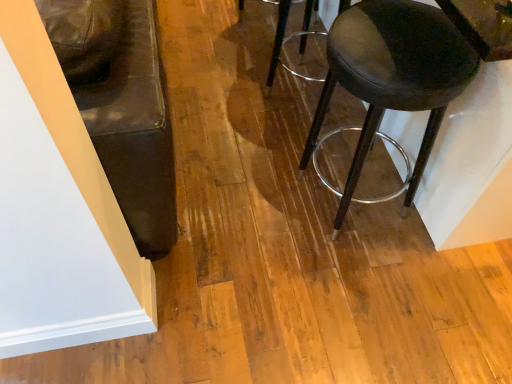
Question: Is matte black stool at right, the 1th stool positioned from the bottom, bigger than transparent plastic stool at center, which ranks as the 2th stool in bottom-to-top order?

Choices:
 (A) no
 (B) yes

Answer: (B)

Question: Does matte black stool at right, which ranks as the 2th stool in top-to-bottom order, have a smaller size compared to transparent plastic stool at center, which ranks as the 2th stool in bottom-to-top order?

Choices:
 (A) no
 (B) yes

Answer: (A)

Question: Considering the relative sizes of matte black stool at right, which ranks as the 2th stool in top-to-bottom order, and transparent plastic stool at center, which ranks as the 2th stool in bottom-to-top order, in the image provided, is matte black stool at right, which ranks as the 2th stool in top-to-bottom order, taller than transparent plastic stool at center, which ranks as the 2th stool in bottom-to-top order,?

Choices:
 (A) yes
 (B) no

Answer: (A)

Question: Does matte black stool at right, which ranks as the 2th stool in top-to-bottom order, lie in front of transparent plastic stool at center, which ranks as the 2th stool in bottom-to-top order?

Choices:
 (A) no
 (B) yes

Answer: (B)

Question: From the image's perspective, is matte black stool at right, the 1th stool positioned from the bottom, over transparent plastic stool at center, which ranks as the 2th stool in bottom-to-top order?

Choices:
 (A) yes
 (B) no

Answer: (B)

Question: Is matte black stool at right, which ranks as the 2th stool in top-to-bottom order, completely or partially outside of transparent plastic stool at center, which ranks as the 2th stool in bottom-to-top order?

Choices:
 (A) no
 (B) yes

Answer: (B)

Question: From the image's perspective, is transparent plastic stool at center, which ranks as the 2th stool in bottom-to-top order, located beneath matte black stool at right, the 1th stool positioned from the bottom?

Choices:
 (A) no
 (B) yes

Answer: (A)

Question: Considering the relative sizes of transparent plastic stool at center, which is the 1th stool in top-to-bottom order, and matte black stool at right, the 1th stool positioned from the bottom, in the image provided, is transparent plastic stool at center, which is the 1th stool in top-to-bottom order, shorter than matte black stool at right, the 1th stool positioned from the bottom,?

Choices:
 (A) yes
 (B) no

Answer: (A)

Question: Does transparent plastic stool at center, which is the 1th stool in top-to-bottom order, appear on the left side of matte black stool at right, which ranks as the 2th stool in top-to-bottom order?

Choices:
 (A) no
 (B) yes

Answer: (B)

Question: From the image's perspective, is transparent plastic stool at center, which ranks as the 2th stool in bottom-to-top order, on top of matte black stool at right, the 1th stool positioned from the bottom?

Choices:
 (A) yes
 (B) no

Answer: (A)

Question: Is transparent plastic stool at center, which is the 1th stool in top-to-bottom order, facing towards matte black stool at right, which ranks as the 2th stool in top-to-bottom order?

Choices:
 (A) yes
 (B) no

Answer: (B)

Question: Is transparent plastic stool at center, which is the 1th stool in top-to-bottom order, not near matte black stool at right, which ranks as the 2th stool in top-to-bottom order?

Choices:
 (A) yes
 (B) no

Answer: (B)

Question: From the image's perspective, is transparent plastic stool at center, which is the 1th stool in top-to-bottom order, positioned above or below matte black stool at right, the 1th stool positioned from the bottom?

Choices:
 (A) below
 (B) above

Answer: (B)